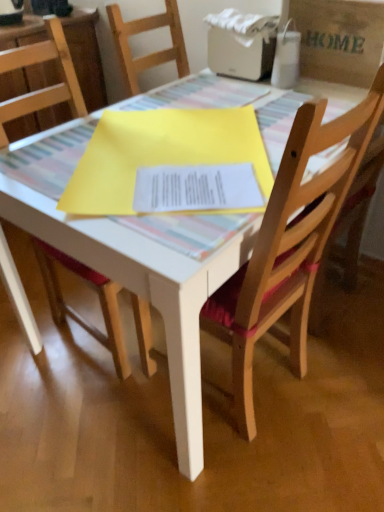
Question: Is wooden chair at center, which is the second chair in right-to-left order, looking in the opposite direction of wooden chair with red cushion at center, which is the 2th chair in left-to-right order?

Choices:
 (A) no
 (B) yes

Answer: (A)

Question: From the image's perspective, is wooden chair at center, the first chair positioned from the left, on wooden chair with red cushion at center, which is the 2th chair in left-to-right order?

Choices:
 (A) no
 (B) yes

Answer: (B)

Question: Is wooden chair at center, which is the second chair in right-to-left order, aimed at wooden chair with red cushion at center, the first chair from the right?

Choices:
 (A) yes
 (B) no

Answer: (A)

Question: Can you confirm if wooden chair at center, the first chair positioned from the left, is smaller than wooden chair with red cushion at center, the first chair from the right?

Choices:
 (A) no
 (B) yes

Answer: (B)

Question: Is wooden chair with red cushion at center, the first chair from the right, surrounded by wooden chair at center, which is the second chair in right-to-left order?

Choices:
 (A) no
 (B) yes

Answer: (A)

Question: Is the position of wooden chair at center, the first chair positioned from the left, less distant than that of wooden chair with red cushion at center, the first chair from the right?

Choices:
 (A) yes
 (B) no

Answer: (B)

Question: From a real-world perspective, is wooden chair at center, which is the second chair in right-to-left order, located beneath white plastic printer at upper center?

Choices:
 (A) yes
 (B) no

Answer: (A)

Question: Would you consider wooden chair at center, the first chair positioned from the left, to be distant from white plastic printer at upper center?

Choices:
 (A) yes
 (B) no

Answer: (A)

Question: Is wooden chair at center, which is the second chair in right-to-left order, to the right of white plastic printer at upper center from the viewer's perspective?

Choices:
 (A) yes
 (B) no

Answer: (B)

Question: Is white plastic printer at upper center completely or partially inside wooden chair at center, which is the second chair in right-to-left order?

Choices:
 (A) no
 (B) yes

Answer: (A)

Question: Is wooden chair at center, the first chair positioned from the left, beside white plastic printer at upper center?

Choices:
 (A) no
 (B) yes

Answer: (A)

Question: Does wooden chair at center, which is the second chair in right-to-left order, have a lesser height compared to white plastic printer at upper center?

Choices:
 (A) no
 (B) yes

Answer: (A)

Question: Is white plastic printer at upper center at the right side of brown paper bag at upper right?

Choices:
 (A) no
 (B) yes

Answer: (A)